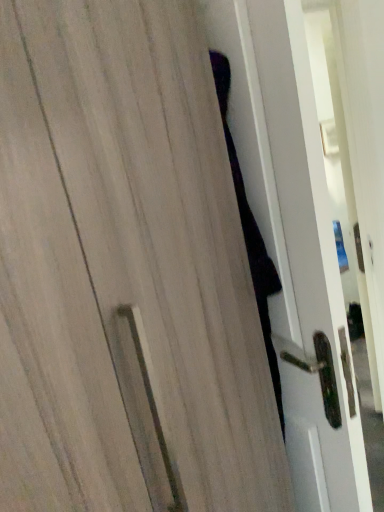
Measure the distance between matte black door at center and camera.

The distance of matte black door at center from camera is 82.54 centimeters.

This screenshot has width=384, height=512. I want to click on matte black door at center, so click(x=304, y=269).

The width and height of the screenshot is (384, 512). What do you see at coordinates (304, 269) in the screenshot? I see `matte black door at center` at bounding box center [304, 269].

Locate an element on the screen. The image size is (384, 512). matte black door at center is located at coordinates (304, 269).